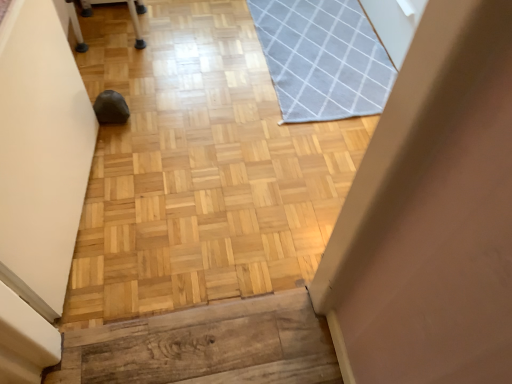
Question: In the image, is matte white plastic chair at upper left positioned in front of or behind gray woven mat at upper right?

Choices:
 (A) behind
 (B) front

Answer: (A)

Question: Considering the positions of matte white plastic chair at upper left and gray woven mat at upper right in the image, is matte white plastic chair at upper left wider or thinner than gray woven mat at upper right?

Choices:
 (A) wide
 (B) thin

Answer: (B)

Question: Is point (136, 34) closer or farther from the camera than point (302, 77)?

Choices:
 (A) farther
 (B) closer

Answer: (A)

Question: In terms of height, does gray woven mat at upper right look taller or shorter compared to matte white plastic chair at upper left?

Choices:
 (A) short
 (B) tall

Answer: (A)

Question: Is gray woven mat at upper right wider or thinner than matte white plastic chair at upper left?

Choices:
 (A) wide
 (B) thin

Answer: (A)

Question: Is gray woven mat at upper right to the left or to the right of matte white plastic chair at upper left in the image?

Choices:
 (A) left
 (B) right

Answer: (B)

Question: Considering the positions of gray woven mat at upper right and matte white plastic chair at upper left in the image, is gray woven mat at upper right bigger or smaller than matte white plastic chair at upper left?

Choices:
 (A) big
 (B) small

Answer: (B)